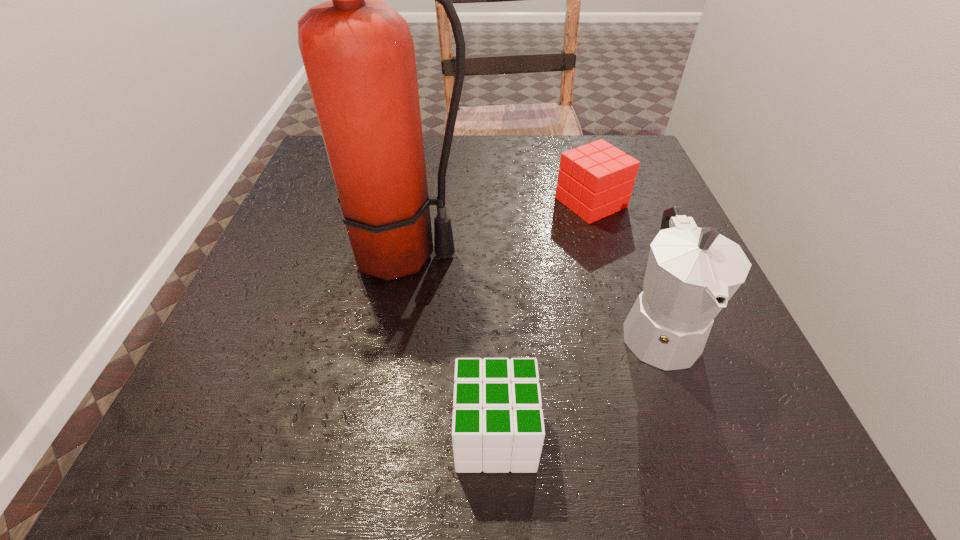
In the image, there is a desktop. Where is `vacant space at the left edge`? Image resolution: width=960 pixels, height=540 pixels. vacant space at the left edge is located at coordinates (269, 324).

You are a GUI agent. You are given a task and a screenshot of the screen. Output one action in this format:
    pyautogui.click(x=<x>, y=<y>)
    Task: Click on the vacant area at the right edge
    The height and width of the screenshot is (540, 960).
    Given the screenshot: What is the action you would take?
    pyautogui.click(x=711, y=366)

Find the location of a particular element. The width and height of the screenshot is (960, 540). vacant position at the far right corner of the desktop is located at coordinates (648, 160).

The image size is (960, 540). I want to click on empty location between the third shortest object and the nearest object, so click(577, 382).

Locate an element on the screen. The image size is (960, 540). vacant space that's between the farther cube and the nearer cube is located at coordinates (543, 319).

You are a GUI agent. You are given a task and a screenshot of the screen. Output one action in this format:
    pyautogui.click(x=<x>, y=<y>)
    Task: Click on the vacant area that lies between the fire extinguisher and the second tallest object
    This screenshot has height=540, width=960.
    Given the screenshot: What is the action you would take?
    pyautogui.click(x=530, y=292)

This screenshot has width=960, height=540. In order to click on free space between the fire extinguisher and the coffeepot in this screenshot , I will do `click(530, 292)`.

Find the location of a particular element. The width and height of the screenshot is (960, 540). free area in between the farthest object and the coffeepot is located at coordinates point(624,266).

Find the location of a particular element. empty space between the fire extinguisher and the third shortest object is located at coordinates (530, 292).

Find the location of a particular element. The height and width of the screenshot is (540, 960). free space between the fire extinguisher and the right cube is located at coordinates (497, 230).